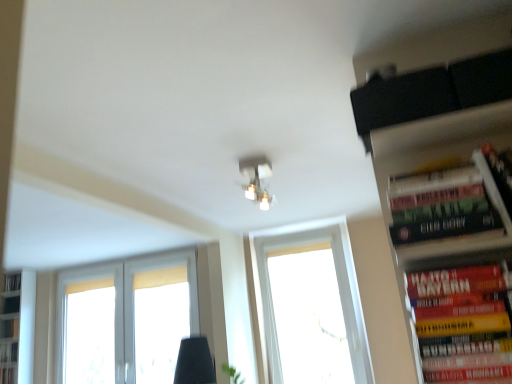
Question: In terms of height, does hardcover book at right, which is the third book in bottom-to-top order, look taller or shorter compared to hardcover book at right, the first book viewed from the right?

Choices:
 (A) short
 (B) tall

Answer: (A)

Question: In the image, is hardcover book at right, arranged as the second book when viewed from the back, positioned in front of or behind hardcover book at right, which is the second book in bottom-to-top order?

Choices:
 (A) front
 (B) behind

Answer: (B)

Question: Which object is the closest to the white matte window at lower left, positioned as the second window in right-to-left order?

Choices:
 (A) hardcover book at right, arranged as the second book when viewed from the back
 (B) white matte bookshelf at left
 (C) transparent glass window at center, the first window when ordered from right to left
 (D) matte white light fixture at center
 (E) hardcover book at lower left, which is the first book from bottom to top

Answer: (B)

Question: Estimate the real-world distances between objects in this image. Which object is farther from the hardcover book at lower left, the third book viewed from the front?

Choices:
 (A) matte white light fixture at center
 (B) white matte bookshelf at left
 (C) white matte window at lower left, arranged as the 1th window when viewed from the left
 (D) hardcover book at right, the first book viewed from the right
 (E) hardcover book at right, positioned as the 2th book in left-to-right order

Answer: (E)